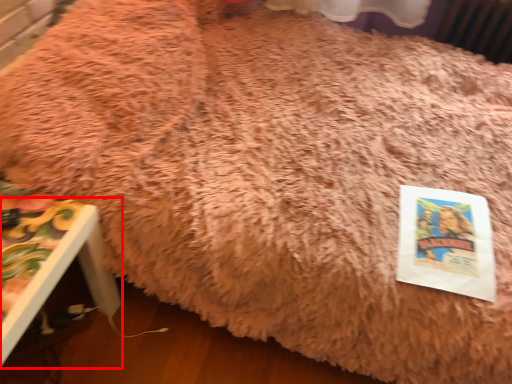
Question: From the image's perspective, where is furniture (annotated by the red box) located in relation to paperback book in the image?

Choices:
 (A) below
 (B) above

Answer: (A)